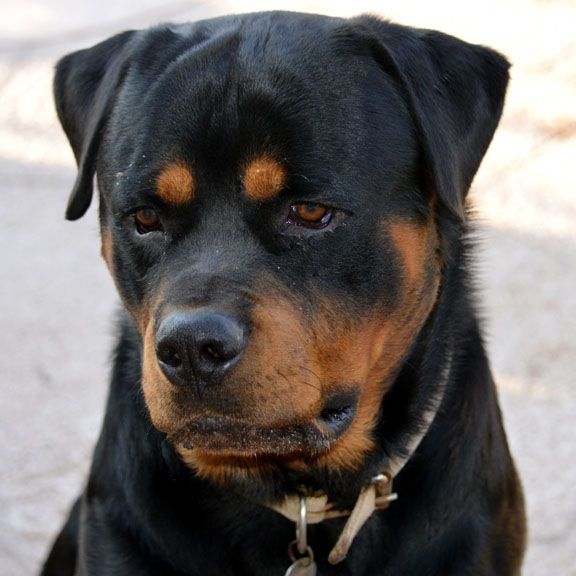
Find the location of a particular element. This screenshot has height=576, width=576. hook is located at coordinates (299, 535).